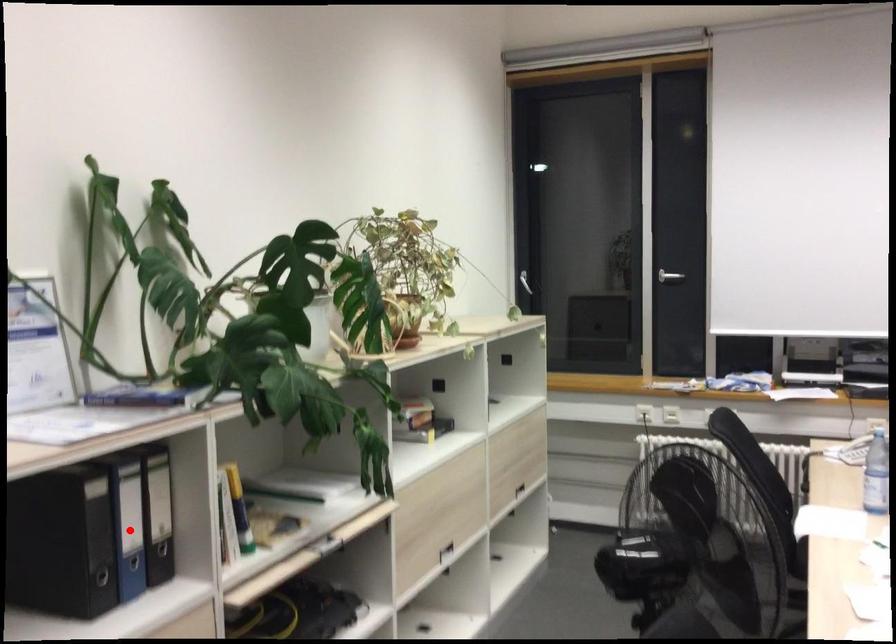
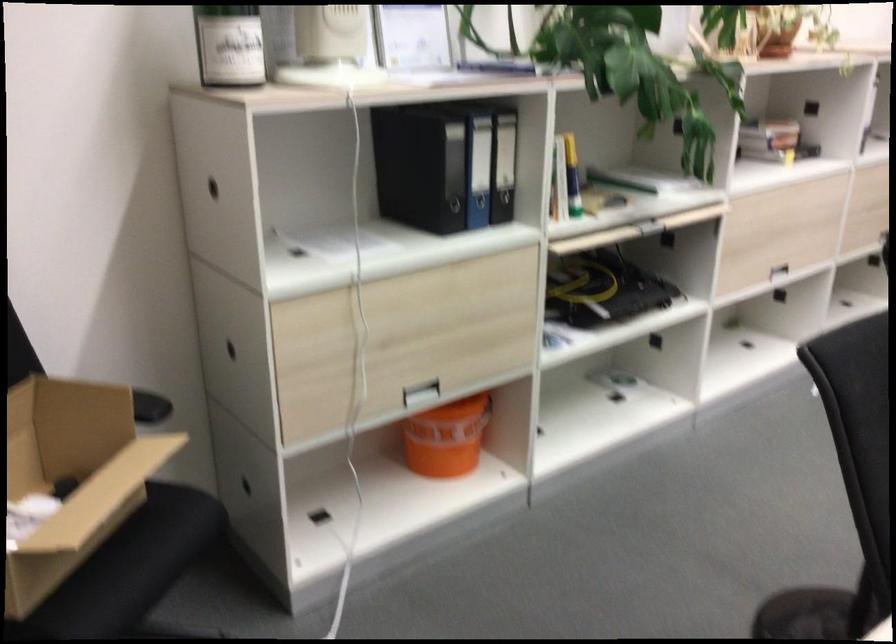
Question: I am providing you with two images of the same scene from different viewpoints. Image1 has a red point marked. In image2, the corresponding 3D location appears at what relative position? Reply with the corresponding letter.

Choices:
 (A) Closer
 (B) Farther

Answer: (B)